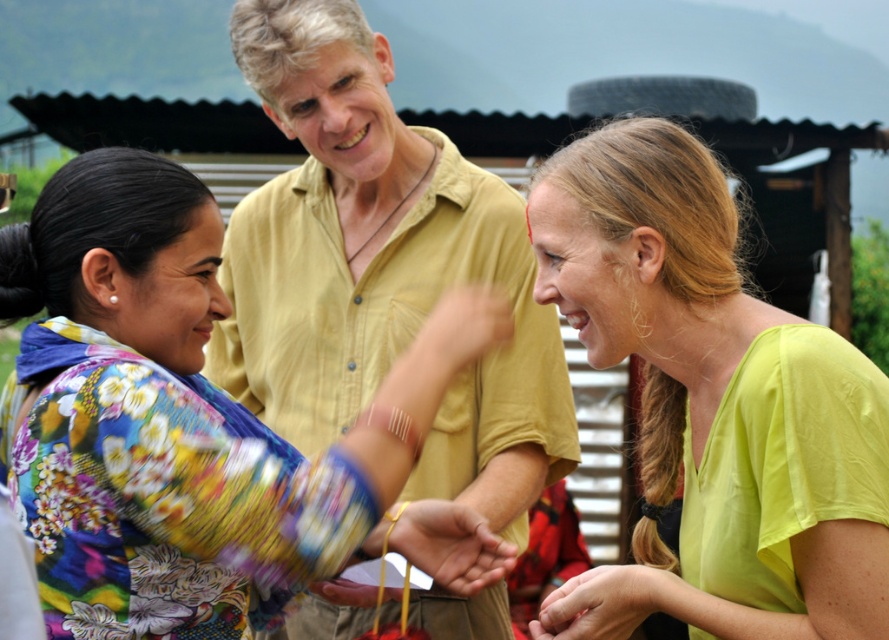
Question: Which object is positioned closest to the smooth skin hand at lower center?

Choices:
 (A) yellow string at center
 (B) lime green fabric at center

Answer: (A)

Question: Is matte yellow shirt at center thinner than yellow string at center?

Choices:
 (A) yes
 (B) no

Answer: (B)

Question: Which object is farther from the camera taking this photo?

Choices:
 (A) smooth skin hand at lower center
 (B) floral fabric blouse at center

Answer: (A)

Question: Observing the image, what is the correct spatial positioning of matte yellow shirt at center in reference to lime green fabric at center?

Choices:
 (A) below
 (B) above

Answer: (B)

Question: Is floral fabric blouse at center to the right of lime green fabric at center from the viewer's perspective?

Choices:
 (A) yes
 (B) no

Answer: (B)

Question: Which of the following is the farthest from the observer?

Choices:
 (A) (437, 328)
 (B) (750, 522)

Answer: (A)